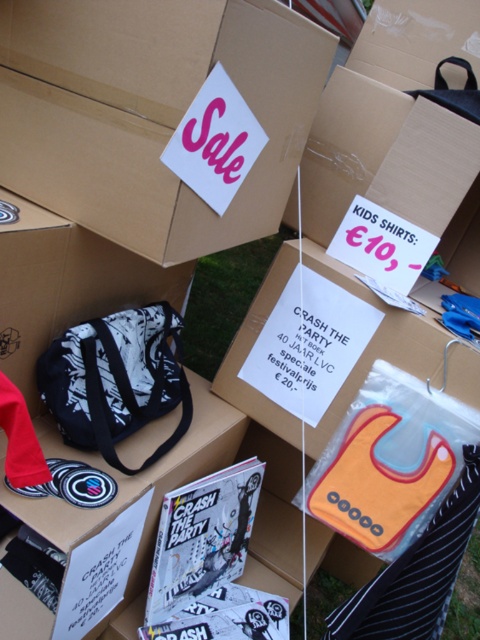
Is matte cardboard box at upper center to the left of orange fabric bib at lower right from the viewer's perspective?

Indeed, matte cardboard box at upper center is positioned on the left side of orange fabric bib at lower right.

Can you confirm if matte cardboard box at upper center is smaller than orange fabric bib at lower right?

No.

The image size is (480, 640). I want to click on matte cardboard box at upper center, so pos(151,112).

Is matte cardboard box at upper center taller than black and white fabric bag at center?

Yes.

Does matte cardboard box at upper center have a greater width compared to black and white fabric bag at center?

Correct, the width of matte cardboard box at upper center exceeds that of black and white fabric bag at center.

What do you see at coordinates (151, 112) in the screenshot? The width and height of the screenshot is (480, 640). I see `matte cardboard box at upper center` at bounding box center [151, 112].

Image resolution: width=480 pixels, height=640 pixels. Identify the location of matte cardboard box at upper center. (151, 112).

Between point (427, 486) and point (115, 323), which one is positioned in front?

Point (115, 323) is more forward.

In the scene shown: Who is lower down, orange fabric bib at lower right or black and white fabric bag at center?

orange fabric bib at lower right

Locate an element on the screen. This screenshot has height=640, width=480. orange fabric bib at lower right is located at coordinates (391, 461).